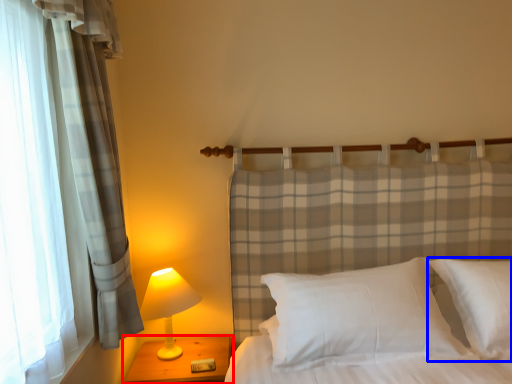
Question: Among these objects, which one is farthest to the camera, nightstand (highlighted by a red box) or pillow (highlighted by a blue box)?

Choices:
 (A) nightstand
 (B) pillow

Answer: (A)